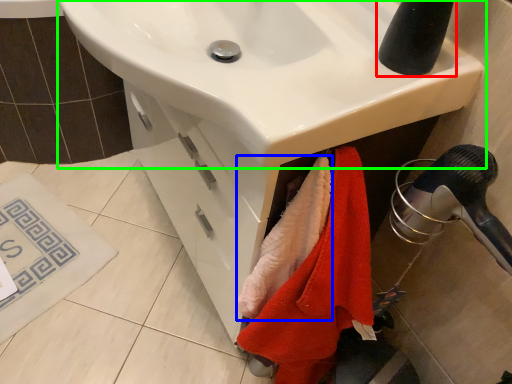
Question: Which is farther away from tap (highlighted by a red box)? beach towel (highlighted by a blue box) or sink (highlighted by a green box)?

Choices:
 (A) beach towel
 (B) sink

Answer: (A)